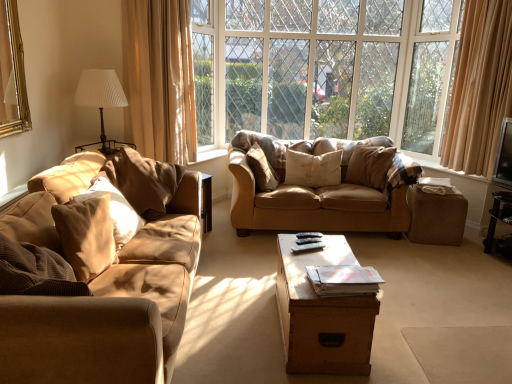
Measure the distance between point (462, 213) and camera.

The depth of point (462, 213) is 3.70 meters.

At what (x,y) coordinates should I click in order to perform the action: click on beige fabric pillow at center, acting as the 6th pillow starting from the left. Please return your answer as a coordinate pair (x, y). The width and height of the screenshot is (512, 384). Looking at the image, I should click on (370, 165).

How much space does brown corduroy pillow at left, marked as the third pillow in a left-to-right arrangement, occupy horizontally?

The width of brown corduroy pillow at left, marked as the third pillow in a left-to-right arrangement, is 22.86 inches.

The image size is (512, 384). What are the coordinates of `white pleated fabric lampshade at upper left` in the screenshot? It's located at (100, 94).

What is the approximate width of metallic silver tv at right?

It is 7.68 inches.

Describe the element at coordinates (321, 186) in the screenshot. I see `suede beige couch at center` at that location.

The width and height of the screenshot is (512, 384). I want to click on wooden trunk at center, so click(322, 314).

Find the location of a particular element. soft beige pillow at left, acting as the 5th pillow starting from the right is located at coordinates (86, 236).

Which of these two, clear glass window at center or brown fabric stool at right, stands taller?

clear glass window at center.

Which point is more forward, [206,10] or [465,202]?

The point [465,202] is closer.

Is clear glass window at center completely or partially outside of brown fabric stool at right?

Yes, clear glass window at center is outside of brown fabric stool at right.

Is brown corduroy pillow at left, which ranks as the 4th pillow in right-to-left order, located within beige fabric curtain at upper left?

No.

Is point (139, 69) positioned after point (168, 167)?

Yes, point (139, 69) is behind point (168, 167).

Which object is wider, beige fabric curtain at upper left or brown corduroy pillow at left, which ranks as the 4th pillow in right-to-left order?

brown corduroy pillow at left, which ranks as the 4th pillow in right-to-left order, is wider.

Could you measure the distance between beige fabric curtain at upper left and brown corduroy pillow at left, which ranks as the 4th pillow in right-to-left order?

A distance of 31.78 inches exists between beige fabric curtain at upper left and brown corduroy pillow at left, which ranks as the 4th pillow in right-to-left order.

Can you confirm if metallic silver tv at right is positioned to the left of plush brown pillow at center, positioned as the third pillow in right-to-left order?

Incorrect, metallic silver tv at right is not on the left side of plush brown pillow at center, positioned as the third pillow in right-to-left order.

Is metallic silver tv at right not near plush brown pillow at center, positioned as the 4th pillow in left-to-right order?

That's right, there is a large distance between metallic silver tv at right and plush brown pillow at center, positioned as the 4th pillow in left-to-right order.

From the image's perspective, which is above, metallic silver tv at right or plush brown pillow at center, positioned as the third pillow in right-to-left order?

metallic silver tv at right.

Considering the sizes of objects white pleated fabric lampshade at upper left and plush brown pillow at center, positioned as the third pillow in right-to-left order, in the image provided, who is thinner, white pleated fabric lampshade at upper left or plush brown pillow at center, positioned as the third pillow in right-to-left order,?

plush brown pillow at center, positioned as the third pillow in right-to-left order.

Would you say white pleated fabric lampshade at upper left is inside or outside plush brown pillow at center, positioned as the third pillow in right-to-left order?

white pleated fabric lampshade at upper left is located beyond the bounds of plush brown pillow at center, positioned as the third pillow in right-to-left order.

Is white pleated fabric lampshade at upper left positioned with its back to plush brown pillow at center, positioned as the third pillow in right-to-left order?

No, plush brown pillow at center, positioned as the third pillow in right-to-left order, is not at the back of white pleated fabric lampshade at upper left.

Could you measure the distance between white pleated fabric lampshade at upper left and plush brown pillow at center, positioned as the 4th pillow in left-to-right order?

The distance of white pleated fabric lampshade at upper left from plush brown pillow at center, positioned as the 4th pillow in left-to-right order, is 4.21 feet.

Does soft beige pillow at left, which is the second pillow from left to right, have a greater height compared to metallic silver tv at right?

No.

Which of these two, soft beige pillow at left, acting as the 5th pillow starting from the right, or metallic silver tv at right, is smaller?

With smaller size is soft beige pillow at left, acting as the 5th pillow starting from the right.

Which of these two, soft beige pillow at left, acting as the 5th pillow starting from the right, or metallic silver tv at right, is thinner?

With smaller width is soft beige pillow at left, acting as the 5th pillow starting from the right.

Can you tell me how much clear glass window at center and white pleated fabric lampshade at upper left differ in facing direction?

clear glass window at center and white pleated fabric lampshade at upper left are facing 55.6 degrees away from each other.

Is clear glass window at center beside white pleated fabric lampshade at upper left?

No, clear glass window at center is not touching white pleated fabric lampshade at upper left.

Which is in front, point (264, 116) or point (105, 103)?

The point (105, 103) is more forward.

Which object is positioned more to the right, clear glass window at center or white pleated fabric lampshade at upper left?

From the viewer's perspective, clear glass window at center appears more on the right side.

From a real-world perspective, who is located higher, clear glass window at center or brown corduroy pillow at left, which ranks as the 4th pillow in right-to-left order?

clear glass window at center, from a real-world perspective.

Is clear glass window at center inside or outside of brown corduroy pillow at left, marked as the third pillow in a left-to-right arrangement?

clear glass window at center lies outside brown corduroy pillow at left, marked as the third pillow in a left-to-right arrangement.

Who is more distant, clear glass window at center or brown corduroy pillow at left, marked as the third pillow in a left-to-right arrangement?

Positioned behind is clear glass window at center.

Can you confirm if clear glass window at center is shorter than brown corduroy pillow at left, which ranks as the 4th pillow in right-to-left order?

Incorrect, the height of clear glass window at center does not fall short of that of brown corduroy pillow at left, which ranks as the 4th pillow in right-to-left order.

In order to click on stool below the clear glass window at center (from the image's perspective) in this screenshot , I will do `click(436, 218)`.

Where is `the 1st pillow directly beneath the beige fabric curtain at upper left (from a real-world perspective)`? the 1st pillow directly beneath the beige fabric curtain at upper left (from a real-world perspective) is located at coordinates (144, 181).

Estimate the real-world distances between objects in this image. Which object is closer to brown corduroy pillow at left, which ranks as the 4th pillow in right-to-left order, soft beige pillow at left, which is the second pillow from left to right, or clear glass window at center?

soft beige pillow at left, which is the second pillow from left to right.

Estimate the real-world distances between objects in this image. Which object is further from wooden trunk at center, plaid fabric at right or metallic silver tv at right?

Among the two, plaid fabric at right is located further to wooden trunk at center.

Looking at the image, which one is located further to suede beige couch at center, plush brown pillow at center, positioned as the 4th pillow in left-to-right order, or brown fabric stool at right?

brown fabric stool at right is positioned further to the anchor suede beige couch at center.

Estimate the real-world distances between objects in this image. Which object is further from suede beige couch at center, wooden trunk at center or metallic silver tv at right?

The object further to suede beige couch at center is metallic silver tv at right.

Which object lies nearer to the anchor point brown corduroy pillow at left, which ranks as the 4th pillow in right-to-left order, beige fabric curtain at upper left or clear glass window at center?

The object closer to brown corduroy pillow at left, which ranks as the 4th pillow in right-to-left order, is beige fabric curtain at upper left.

Based on their spatial positions, is soft beige pillow at left, acting as the 5th pillow starting from the right, or plush brown pillow at center, positioned as the 4th pillow in left-to-right order, closer to beige fabric curtain at upper left?

plush brown pillow at center, positioned as the 4th pillow in left-to-right order.

From the picture: Based on their spatial positions, is metallic silver tv at right or suede beige couch at center further from clear glass window at center?

The object further to clear glass window at center is metallic silver tv at right.

Considering their positions, is suede-like beige pillow at center, positioned as the fifth pillow in left-to-right order, positioned closer to metallic silver tv at right than soft beige pillow at left, which is the second pillow from left to right?

Based on the image, suede-like beige pillow at center, positioned as the fifth pillow in left-to-right order, appears to be nearer to metallic silver tv at right.

The width and height of the screenshot is (512, 384). Find the location of `pillow positioned between soft beige pillow at left, which is the second pillow from left to right, and brown corduroy pillow at left, marked as the third pillow in a left-to-right arrangement, from near to far`. pillow positioned between soft beige pillow at left, which is the second pillow from left to right, and brown corduroy pillow at left, marked as the third pillow in a left-to-right arrangement, from near to far is located at coordinates (114, 209).

The height and width of the screenshot is (384, 512). In order to click on stool situated between suede beige couch at center and plaid fabric at right from left to right in this screenshot , I will do `click(436, 218)`.

Find the location of a particular element. The height and width of the screenshot is (384, 512). stool between soft beige pillow at left, acting as the 5th pillow starting from the right, and clear glass window at center, along the z-axis is located at coordinates (436, 218).

Image resolution: width=512 pixels, height=384 pixels. In order to click on window located between suede-like beige pillow at center, which is counted as the second pillow, starting from the right, and plaid fabric at right in the left-right direction in this screenshot , I will do `click(326, 69)`.